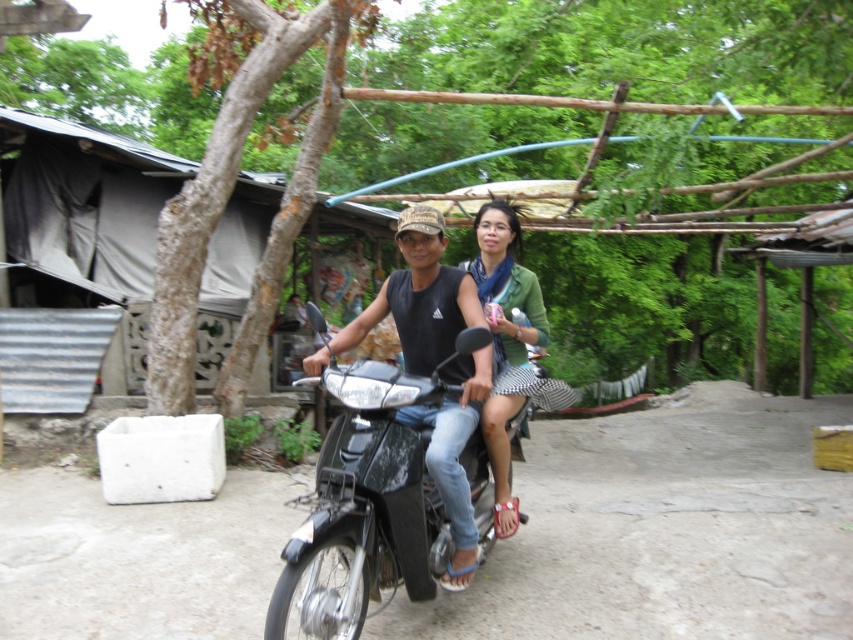
Question: Which point is closer to the camera?

Choices:
 (A) (347, 541)
 (B) (460, 525)
 (C) (498, 204)

Answer: (A)

Question: Where is shiny black motorcycle at center located in relation to matte black motorcycle at center in the image?

Choices:
 (A) below
 (B) above

Answer: (A)

Question: Can you confirm if shiny black motorcycle at center is bigger than green matte shirt at center?

Choices:
 (A) no
 (B) yes

Answer: (B)

Question: Which object is farther from the camera taking this photo?

Choices:
 (A) shiny black motorcycle at center
 (B) matte black motorcycle at center

Answer: (B)

Question: Which is nearer to the matte black motorcycle at center?

Choices:
 (A) shiny black motorcycle at center
 (B) green matte shirt at center

Answer: (A)

Question: Can you confirm if shiny black motorcycle at center is bigger than matte black motorcycle at center?

Choices:
 (A) yes
 (B) no

Answer: (A)